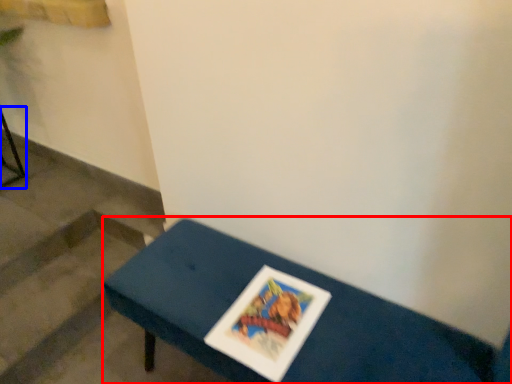
Question: Which point is further to the camera, table (highlighted by a red box) or furniture (highlighted by a blue box)?

Choices:
 (A) table
 (B) furniture

Answer: (B)